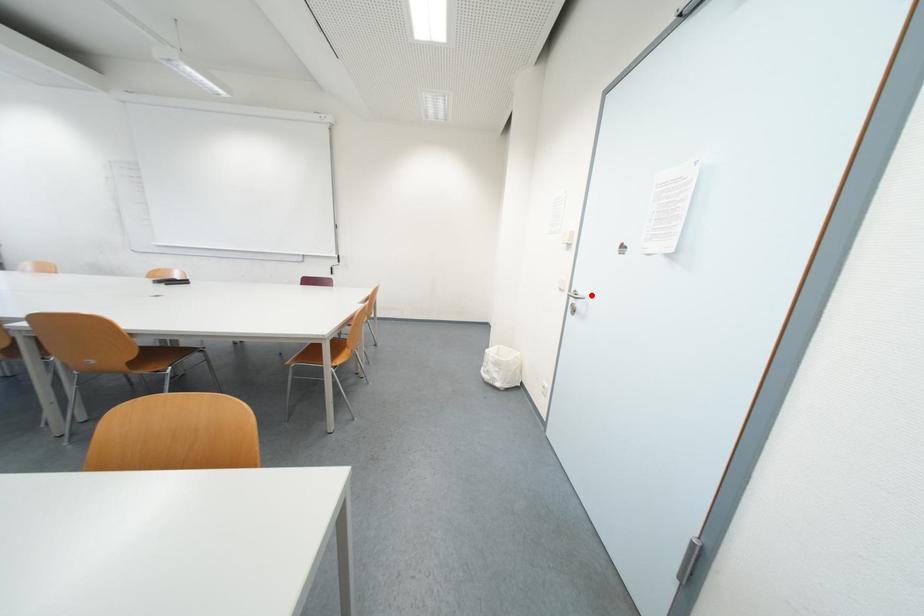
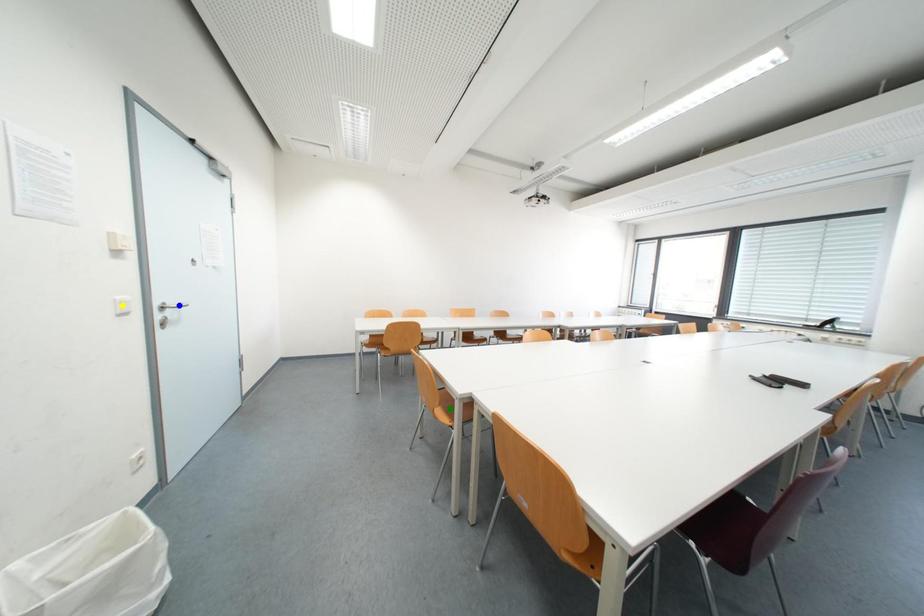
Question: I am providing you with two images of the same scene from different viewpoints. A red point is marked on the first image. You are given multiple points on the second image. In image 2, which mark is for the same physical point as the one in image 1?

Choices:
 (A) green point
 (B) blue point
 (C) yellow point

Answer: (B)